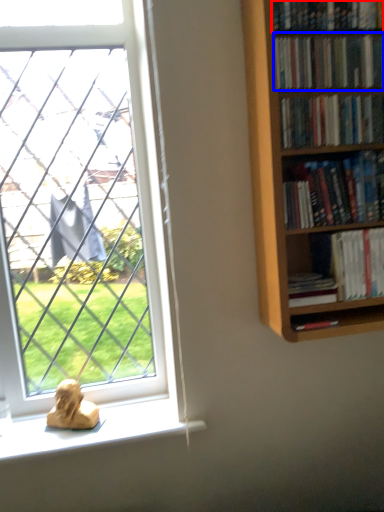
Question: Among these objects, which one is farthest to the camera, book (highlighted by a red box) or book (highlighted by a blue box)?

Choices:
 (A) book
 (B) book

Answer: (B)